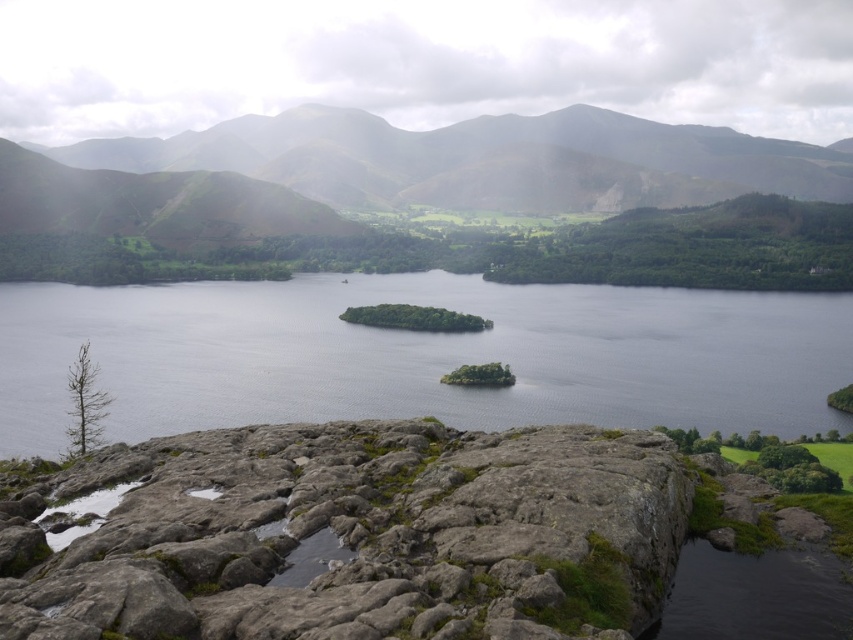
Which of these two, gray rock at bottom or green grassy hill at upper center, stands taller?

green grassy hill at upper center is taller.

Which is more to the right, gray rock at bottom or green grassy hill at upper center?

From the viewer's perspective, green grassy hill at upper center appears more on the right side.

Who is more distant from viewer, (94, 618) or (287, 112)?

Positioned behind is point (287, 112).

Find the location of a particular element. Image resolution: width=853 pixels, height=640 pixels. gray rock at bottom is located at coordinates (361, 536).

Does gray rock at bottom lie in front of clear water at center?

That is True.

Who is taller, gray rock at bottom or clear water at center?

clear water at center

Which is in front, point (247, 493) or point (165, 333)?

Point (247, 493)

Find the location of a particular element. The height and width of the screenshot is (640, 853). gray rock at bottom is located at coordinates (361, 536).

Is point (352, 353) behind point (224, 170)?

No, it is in front of (224, 170).

Does clear water at center appear on the right side of green grassy hill at upper center?

Indeed, clear water at center is positioned on the right side of green grassy hill at upper center.

Where is `clear water at center`? The width and height of the screenshot is (853, 640). clear water at center is located at coordinates point(419,356).